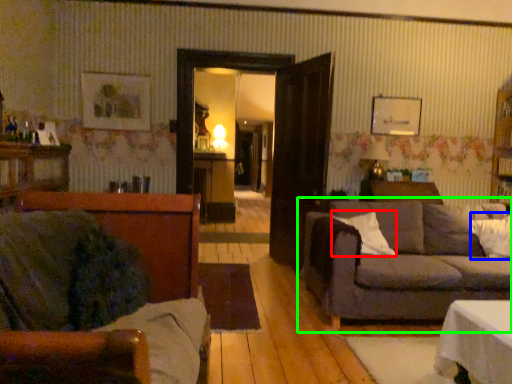
Question: Based on their relative distances, which object is nearer to pillow (highlighted by a red box)? Choose from pillow (highlighted by a blue box) and studio couch (highlighted by a green box).

Choices:
 (A) pillow
 (B) studio couch

Answer: (B)